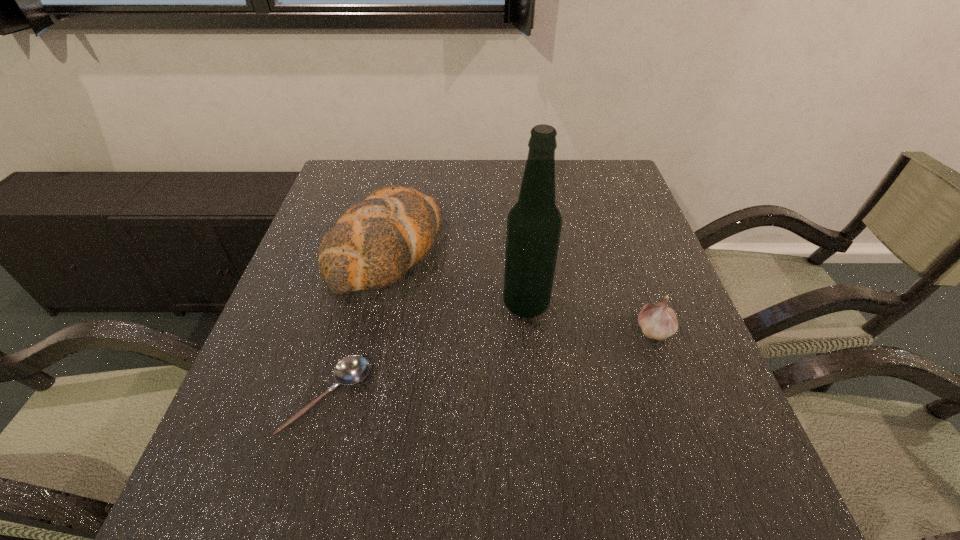
Locate an element on the screen. free spot located 0.330m on the right of the nearest object is located at coordinates (542, 397).

Where is `bread situated at the left edge`? This screenshot has height=540, width=960. bread situated at the left edge is located at coordinates (374, 242).

Locate an element on the screen. ladle positioned at the left edge is located at coordinates (350, 370).

The image size is (960, 540). Find the location of `object situated at the right edge`. object situated at the right edge is located at coordinates 658,321.

At what (x,y) coordinates should I click in order to perform the action: click on vacant space at the far edge. Please return your answer as a coordinate pair (x, y). The width and height of the screenshot is (960, 540). Looking at the image, I should click on (507, 164).

This screenshot has width=960, height=540. Find the location of `vacant space at the left edge of the desktop`. vacant space at the left edge of the desktop is located at coordinates (295, 264).

Where is `vacant area at the right edge`? Image resolution: width=960 pixels, height=540 pixels. vacant area at the right edge is located at coordinates (640, 396).

Where is `vacant space at the far left corner of the desktop`? The width and height of the screenshot is (960, 540). vacant space at the far left corner of the desktop is located at coordinates (343, 200).

I want to click on vacant position at the near left corner of the desktop, so click(x=212, y=482).

Locate an element on the screen. The height and width of the screenshot is (540, 960). vacant space at the far right corner is located at coordinates (601, 165).